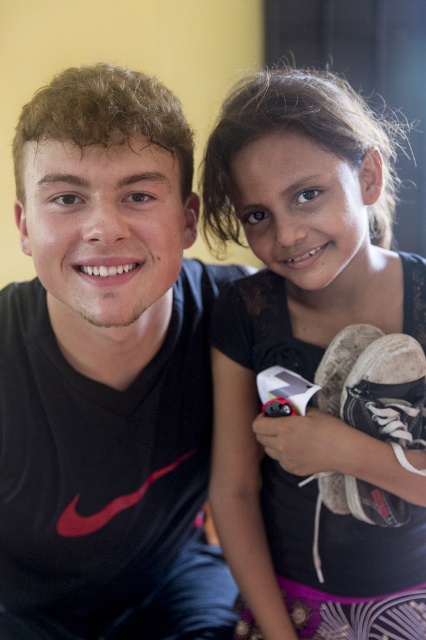
You are standing in front of the image and want to locate the black matte shirt at left. Which direction should you look relative to the center of the image?

The black matte shirt at left is located at point (x=108, y=372), so you should look to the upper right relative to the center of the image.